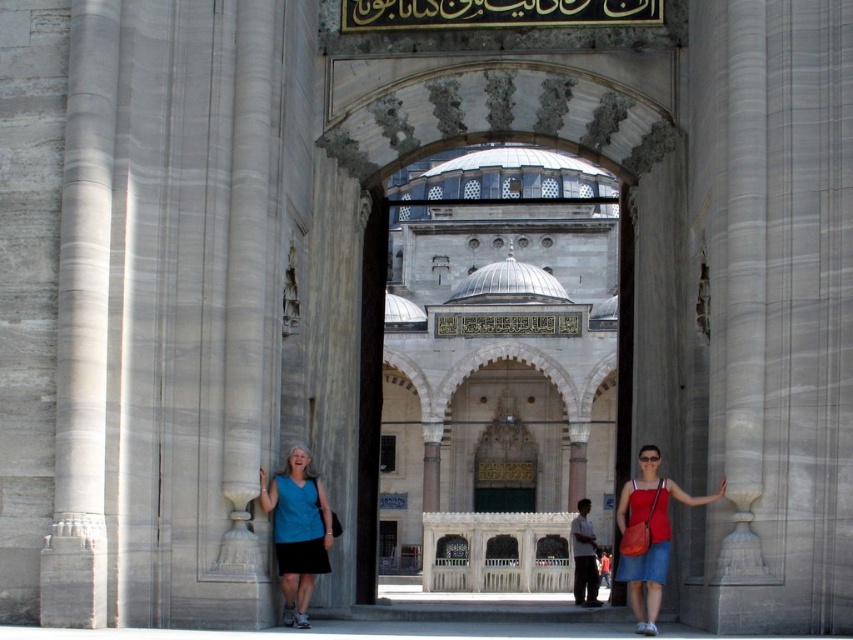
Question: Which of the following is the closest to the observer?

Choices:
 (A) (309, 497)
 (B) (595, 593)
 (C) (653, 454)

Answer: (C)

Question: Can you confirm if blue fabric dress at lower left is wider than red fabric bag at right?

Choices:
 (A) yes
 (B) no

Answer: (B)

Question: Which of the following is the farthest from the observer?

Choices:
 (A) red fabric bag at right
 (B) matte blue shirt at center
 (C) blue fabric dress at lower left
 (D) white marble arch at center

Answer: (B)

Question: Which point is farther to the camera?

Choices:
 (A) red fabric bag at right
 (B) matte blue shirt at center

Answer: (B)

Question: Does blue fabric dress at lower left appear on the right side of red fabric bag at right?

Choices:
 (A) no
 (B) yes

Answer: (A)

Question: Does white marble arch at center come behind blue fabric dress at lower left?

Choices:
 (A) no
 (B) yes

Answer: (B)